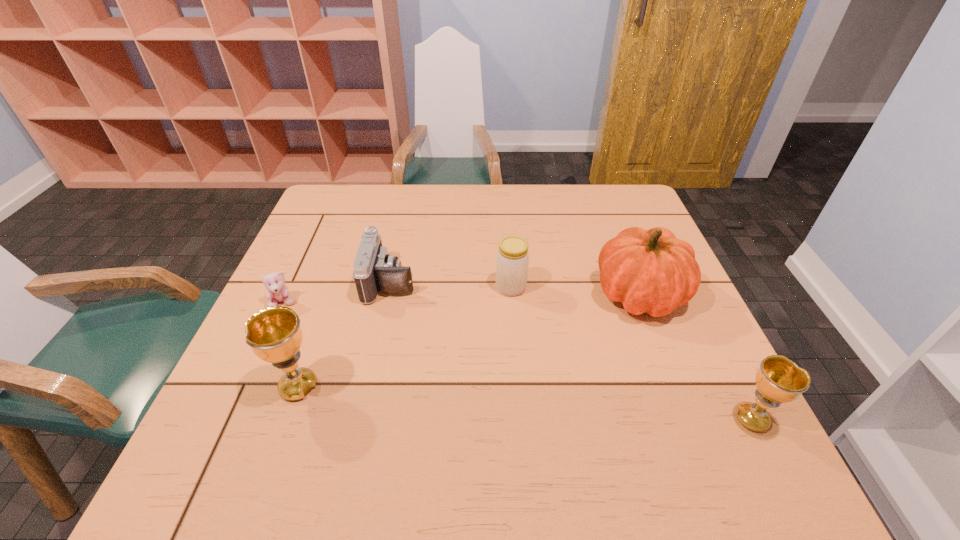
Image resolution: width=960 pixels, height=540 pixels. Find the location of `the left chalice`. the left chalice is located at coordinates (274, 334).

You are a GUI agent. You are given a task and a screenshot of the screen. Output one action in this format:
    pyautogui.click(x=<x>, y=<y>)
    Task: Click on the taller chalice
    The image size is (960, 540).
    Given the screenshot: What is the action you would take?
    pyautogui.click(x=274, y=334)

The width and height of the screenshot is (960, 540). In order to click on the shorter chalice in this screenshot , I will do `click(779, 380)`.

At what (x,y) coordinates should I click in order to perform the action: click on the third object from left to right. Please return your answer as a coordinate pair (x, y). The image size is (960, 540). Looking at the image, I should click on (375, 270).

Locate an element on the screen. The image size is (960, 540). the fifth tallest object is located at coordinates (375, 270).

What are the coordinates of `pumpkin` in the screenshot? It's located at (652, 271).

Locate an element on the screen. This screenshot has height=540, width=960. jar is located at coordinates pos(512,261).

This screenshot has width=960, height=540. Find the location of `teddy bear`. teddy bear is located at coordinates (277, 291).

I want to click on the shortest object, so click(277, 291).

Find the location of a particular element. The height and width of the screenshot is (540, 960). vacant space located 0.210m on the right of the fifth object from right to left is located at coordinates (425, 387).